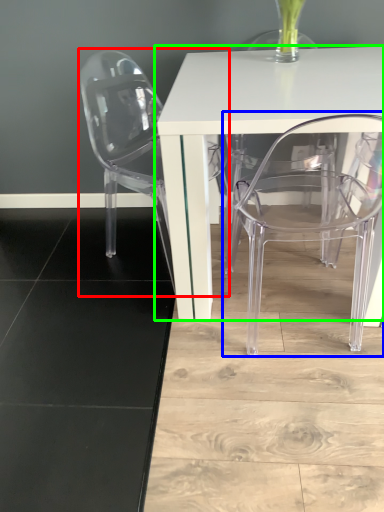
Question: Which is nearer to the chair (highlighted by a red box)? chair (highlighted by a blue box) or table (highlighted by a green box).

Choices:
 (A) chair
 (B) table

Answer: (B)